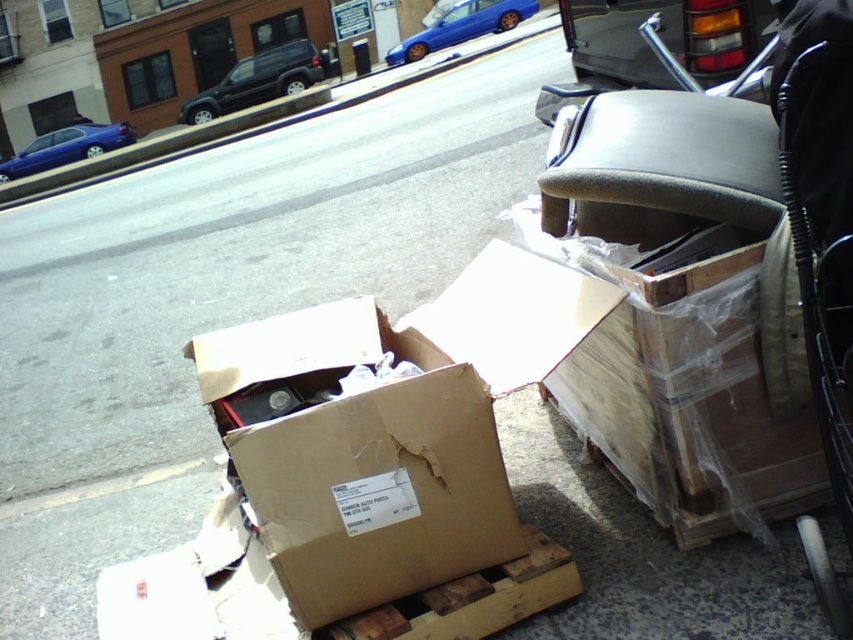
You are a delivery person who needs to place a new metallic gray tail light at upper right onto the brown cardboard box at center. Is the current position of the tail light above or below the box?

The brown cardboard box at center is located below metallic gray tail light at upper right, so the tail light is currently positioned above the box.

You are a delivery person trying to park your black matte suv at upper left in a parking spot located at coordinates 0.15, 0.35. Will your vehicle fit into the parking spot?

The black matte suv at upper left is positioned at point (257,81), which is close to the parking spot at (298,96) but the exact dimensions of the vehicle and parking spot are not provided. Without knowing the size of the suv or the parking spot, it is impossible to determine if it will fit.

You are a delivery person who needs to load the brown cardboard box at center and the metallic gray tail light at upper right onto a truck. The truck has a height restriction of 1.5 meters. Can both items be loaded without any adjustments?

The brown cardboard box at center is not as tall as metallic gray tail light at upper right. Since the truck has a height restriction of 1.5 meters, if the metallic gray tail light at upper right is under 1.5 meters in height, both can be loaded. However, if the tail light exceeds the limit, adjustments would be needed.